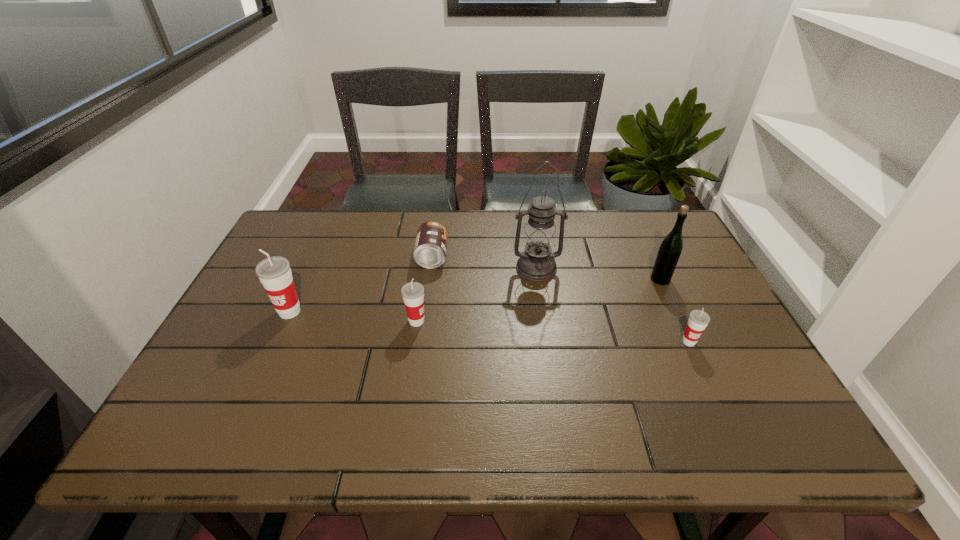
Where is `free spot between the nearest cup and the can`? free spot between the nearest cup and the can is located at coordinates (561, 299).

This screenshot has height=540, width=960. I want to click on free space between the beer bottle and the leftmost object, so click(x=475, y=295).

Identify the location of vacant area that lies between the second tallest cup and the can. (424, 289).

Where is `free space between the shortest object and the leftmost object`? free space between the shortest object and the leftmost object is located at coordinates (361, 284).

The height and width of the screenshot is (540, 960). Identify the location of free space that is in between the nearest cup and the leftmost cup. (490, 327).

Find the location of a particular element. The height and width of the screenshot is (540, 960). object that is the fourth closest to the oil lamp is located at coordinates [698, 320].

At what (x,y) coordinates should I click in order to perform the action: click on the second closest object to the oil lamp. Please return your answer as a coordinate pair (x, y). Looking at the image, I should click on (671, 247).

Find the location of a particular element. The height and width of the screenshot is (540, 960). cup that stands as the third closest to the beer bottle is located at coordinates tap(274, 273).

You are a GUI agent. You are given a task and a screenshot of the screen. Output one action in this format:
    pyautogui.click(x=<x>, y=<y>)
    Task: Click on the cup that stands as the closest to the beer bottle
    The image size is (960, 540).
    Given the screenshot: What is the action you would take?
    pyautogui.click(x=698, y=320)

What are the coordinates of `vacant space that satisfies the following two spatial constraints: 1. on the front label of the shortest object; 2. on the left side of the beer bottle` in the screenshot? It's located at (429, 279).